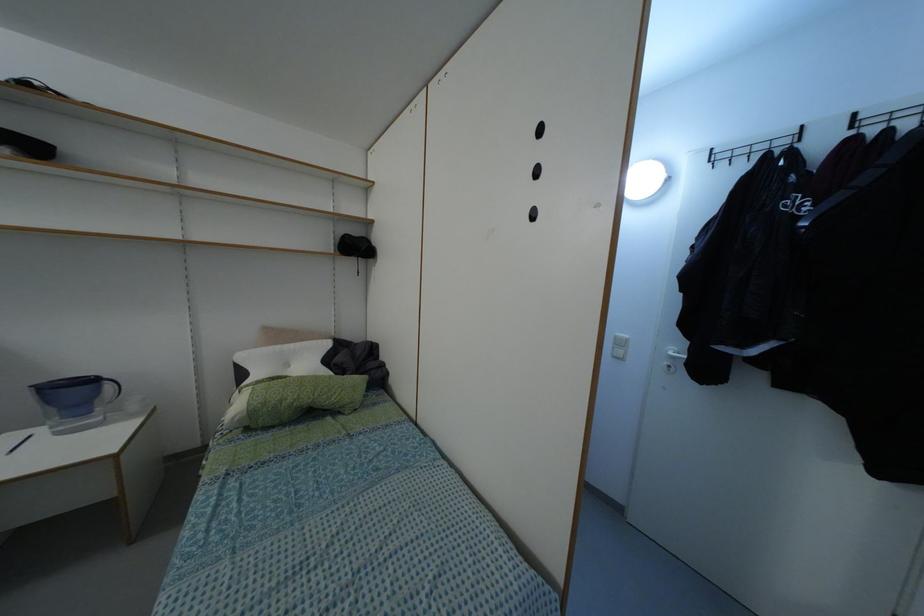
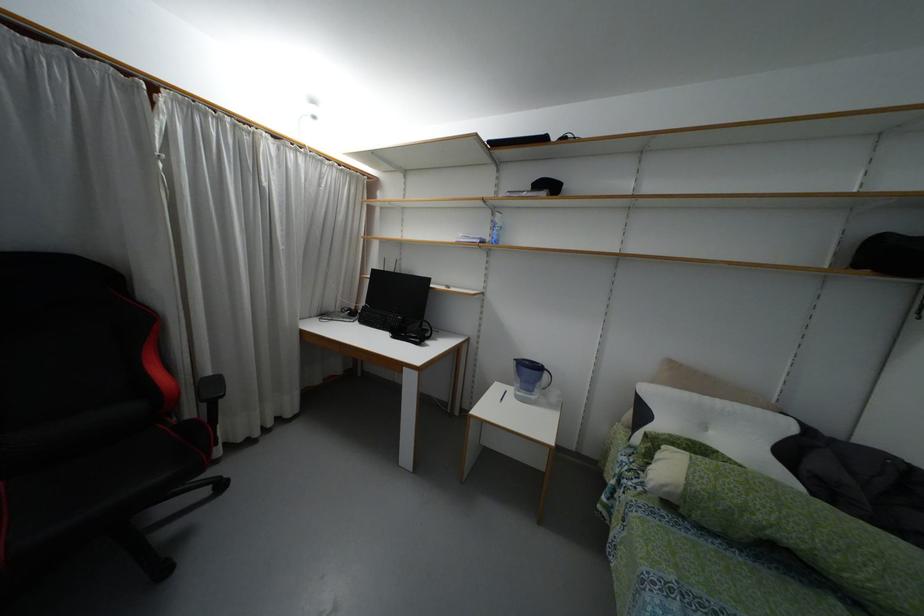
The point at (248, 405) is marked in the first image. Where is the corresponding point in the second image?

(687, 483)